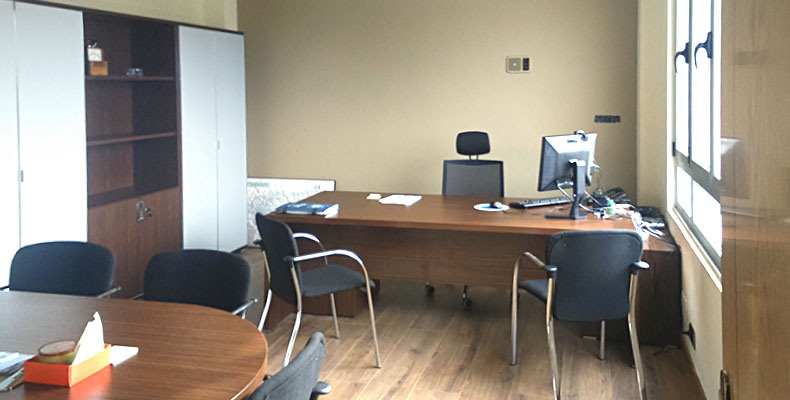
You are a GUI agent. You are given a task and a screenshot of the screen. Output one action in this format:
    pyautogui.click(x=<x>, y=<y>)
    Task: Click on the wood laminate floor
    The image size is (790, 400).
    Given the screenshot: What is the action you would take?
    pyautogui.click(x=457, y=348)